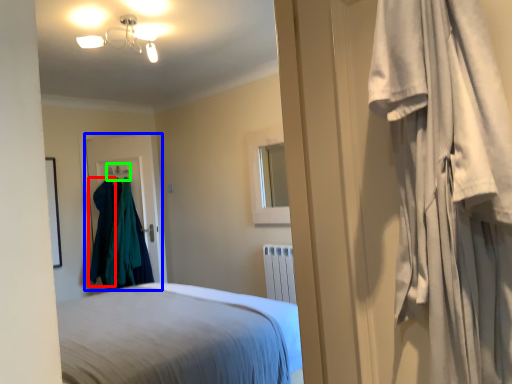
Question: Considering the real-world distances, which object is closest to clothing (highlighted by a red box)? door (highlighted by a blue box) or hanger (highlighted by a green box).

Choices:
 (A) door
 (B) hanger

Answer: (A)